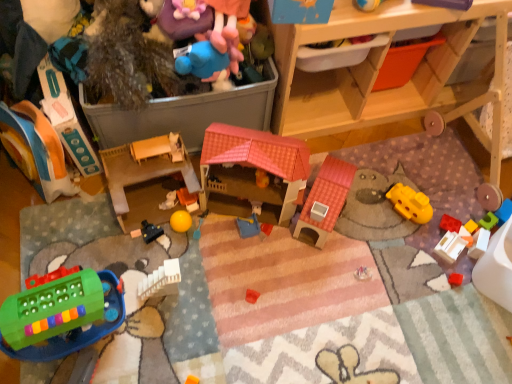
At what (x,y) coordinates should I click in order to perform the action: click on free space behind green plastic building block at lower left, which is the 3th toy in left-to-right order. Please return your answer as a coordinate pair (x, y). The width and height of the screenshot is (512, 384). Looking at the image, I should click on (86, 244).